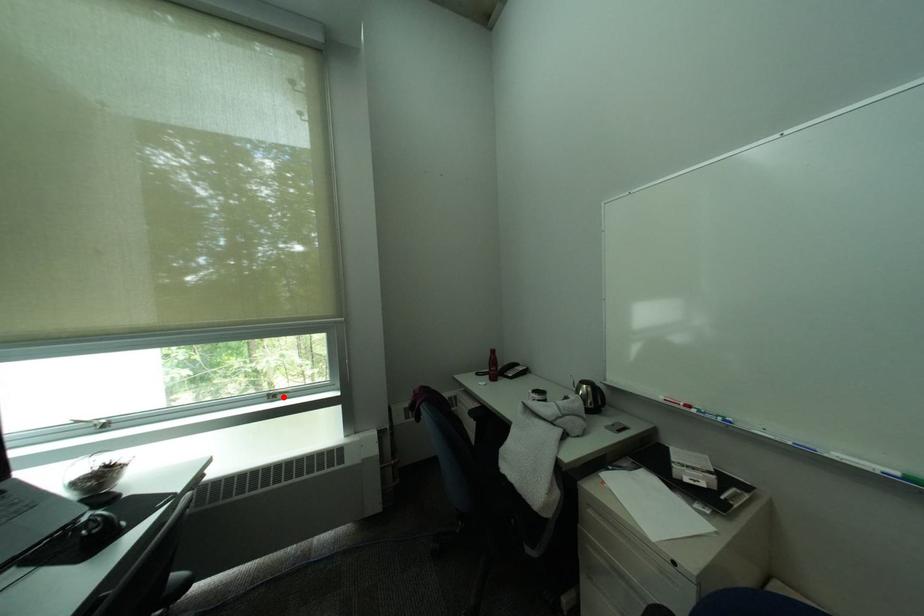
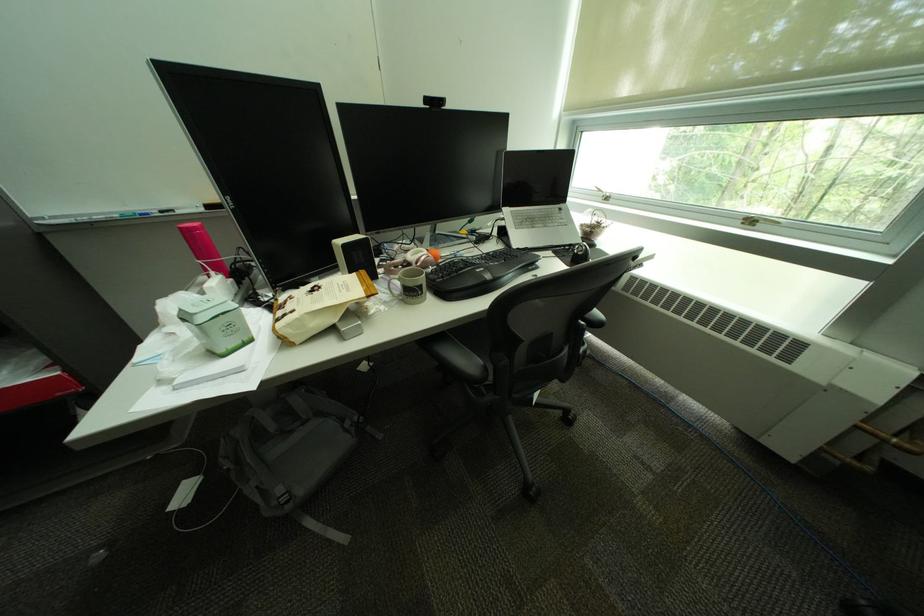
Find the pixel in the second image that matches the highlighted location in the first image.

(761, 224)